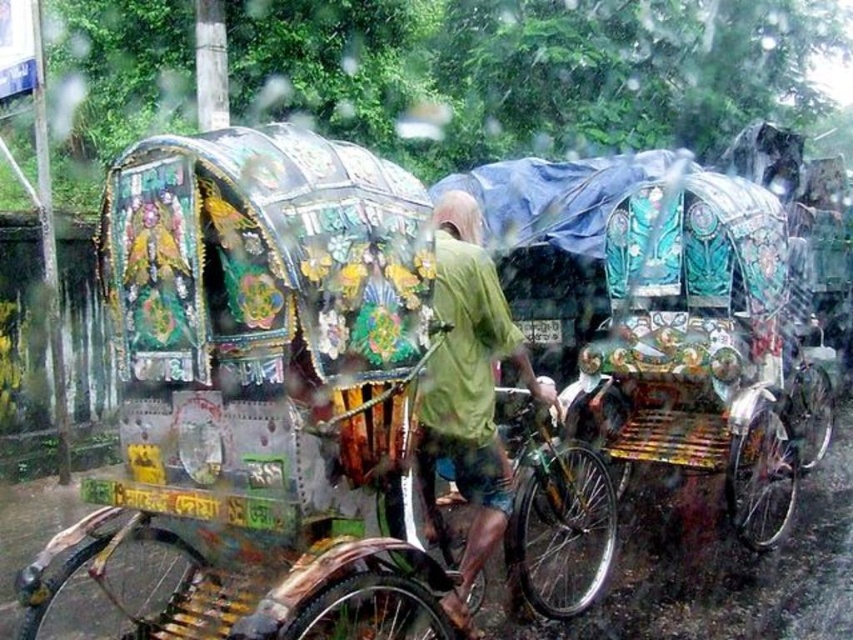
You are standing in the rain near the rickshaws. There is a specific point at coordinates point (135, 298) that you want to reach. Considering your height is 5.5 feet, can you safely step over to that point without getting wet from the rain?

The distance of point (135, 298) from viewer is 7.43 feet, so you can safely step over to that point as it is within a reachable distance and the rain won

You are a photographer trying to capture the rickshaws under the rain. You notice two points marked on your camera screen at coordinates point (456, 314) and point (515, 429). Which point is closer to your camera lens?

Point (456, 314) is closer to the camera lens than point (515, 429).